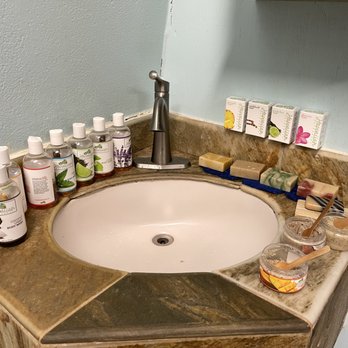
Find the location of `back wall`. back wall is located at coordinates (85, 37), (249, 59).